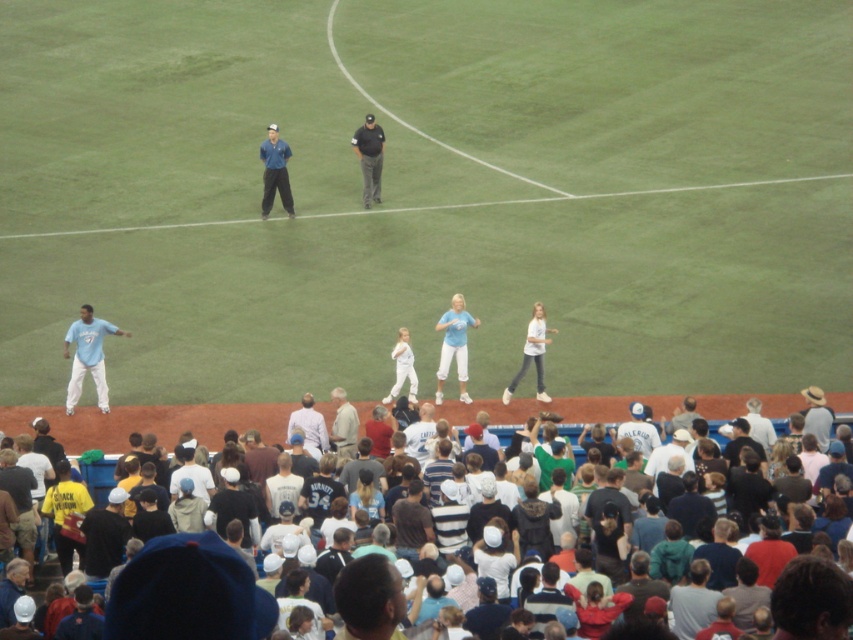
Question: Can you confirm if blue fabric uniform at center is bigger than white matte jeans at center?

Choices:
 (A) yes
 (B) no

Answer: (B)

Question: Considering the real-world distances, which object is farthest from the blue fabric uniform at center?

Choices:
 (A) light blue fabric at center
 (B) white matte jeans at center
 (C) light brown leather jacket at center
 (D) light blue jersey at left

Answer: (C)

Question: Is light blue jersey at left to the left of light brown leather jacket at center from the viewer's perspective?

Choices:
 (A) yes
 (B) no

Answer: (A)

Question: Which object is the farthest from the light blue fabric at center?

Choices:
 (A) light blue shirt at center
 (B) light blue jersey at left
 (C) white matte jeans at center

Answer: (B)

Question: Which point is closer to the camera taking this photo?

Choices:
 (A) tap(321, 440)
 (B) tap(465, 388)
 (C) tap(90, 320)

Answer: (A)

Question: Does light blue jersey at left come in front of light brown leather jacket at center?

Choices:
 (A) no
 (B) yes

Answer: (A)